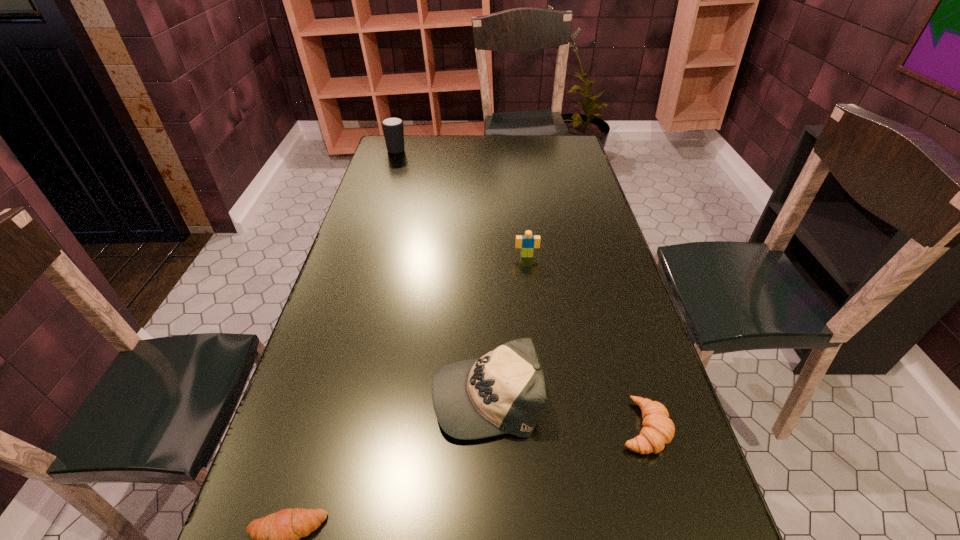
Identify the location of free location that satisfies the following two spatial constraints: 1. on the face of the Lego; 2. on the right side of the rightmost object. The height and width of the screenshot is (540, 960). (548, 427).